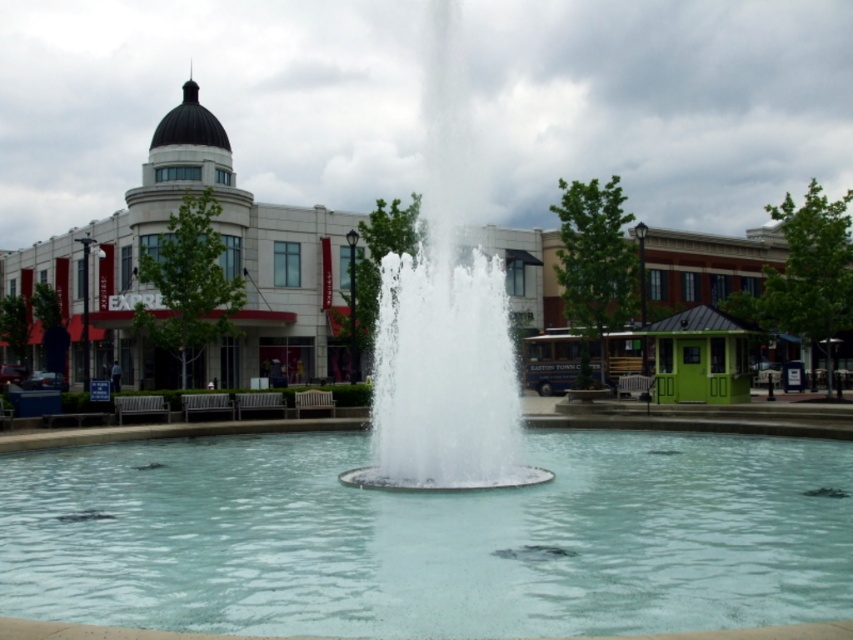
Describe the element at coordinates (430, 538) in the screenshot. I see `clear glass pool at center` at that location.

Is clear glass pool at center in front of clear water fountain at center?

Yes, it is in front of clear water fountain at center.

Image resolution: width=853 pixels, height=640 pixels. I want to click on clear glass pool at center, so click(x=430, y=538).